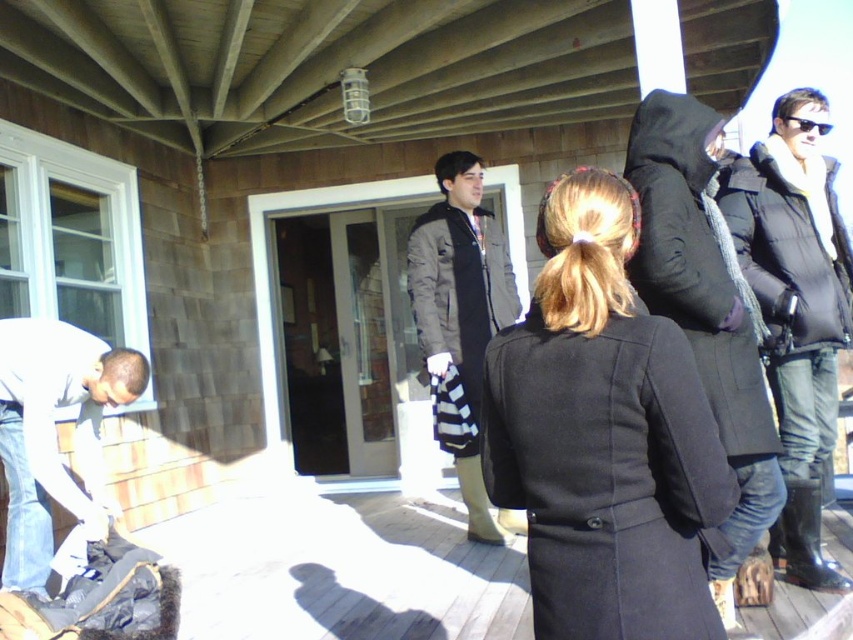
Is point (788, 637) behind point (805, 444)?

No, it is not.

Does black fabric coat at center have a greater height compared to black puffy jacket at right?

In fact, black fabric coat at center may be shorter than black puffy jacket at right.

Who is more forward, (433,563) or (802,285)?

Point (802,285) is more forward.

The image size is (853, 640). I want to click on black fabric coat at center, so click(x=341, y=570).

Can you confirm if black puffy jacket at right is positioned below dark gray fabric coat at center?

No, black puffy jacket at right is not below dark gray fabric coat at center.

Where is `black puffy jacket at right`? black puffy jacket at right is located at coordinates (796, 310).

Does black puffy jacket at right have a smaller size compared to white cotton shirt at lower left?

No.

Does black puffy jacket at right appear under white cotton shirt at lower left?

Actually, black puffy jacket at right is above white cotton shirt at lower left.

Is point (740, 157) positioned behind point (96, 534)?

Yes.

This screenshot has width=853, height=640. I want to click on black puffy jacket at right, so click(796, 310).